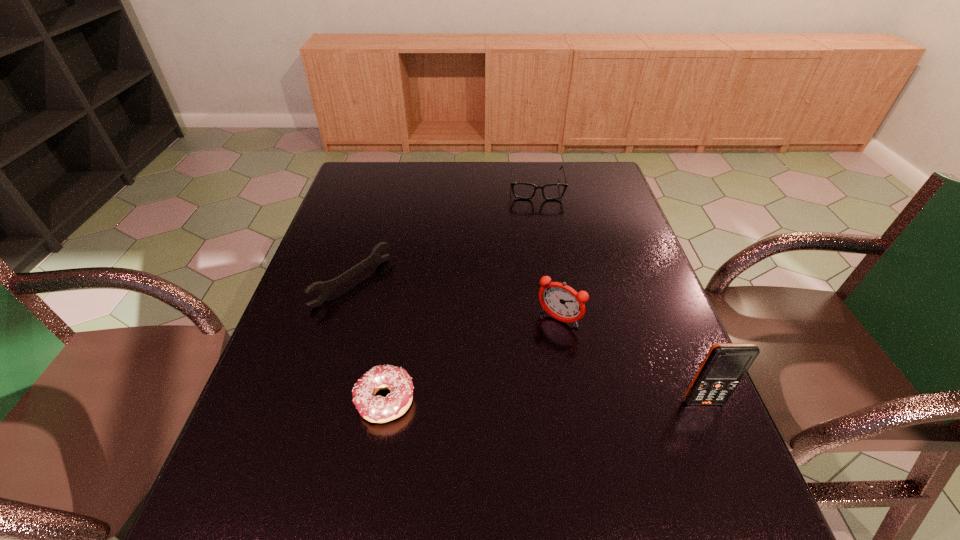
You are a GUI agent. You are given a task and a screenshot of the screen. Output one action in this format:
    pyautogui.click(x=<x>, y=<y>)
    Task: Click on the doughnut
    
    Given the screenshot: What is the action you would take?
    pyautogui.click(x=377, y=409)

At what (x,y) coordinates should I click in order to perform the action: click on cellular telephone. Please return your answer as a coordinate pair (x, y). Looking at the image, I should click on (725, 364).

Where is `the tallest object`? The height and width of the screenshot is (540, 960). the tallest object is located at coordinates (725, 364).

Image resolution: width=960 pixels, height=540 pixels. Find the location of `alarm clock`. alarm clock is located at coordinates (562, 302).

Where is `the farthest object`? The height and width of the screenshot is (540, 960). the farthest object is located at coordinates (552, 191).

The width and height of the screenshot is (960, 540). I want to click on wrench, so click(x=326, y=288).

Locate an element on the screen. blank space located on the right of the doughnut is located at coordinates (504, 401).

I want to click on free space located 0.130m on the screen of the tallest object, so click(x=732, y=472).

Where is `free spot located 0.170m on the front-facing side of the alarm clock`? This screenshot has height=540, width=960. free spot located 0.170m on the front-facing side of the alarm clock is located at coordinates (513, 383).

What are the coordinates of `vacant area located 0.110m on the front-facing side of the alarm clock` in the screenshot? It's located at (526, 363).